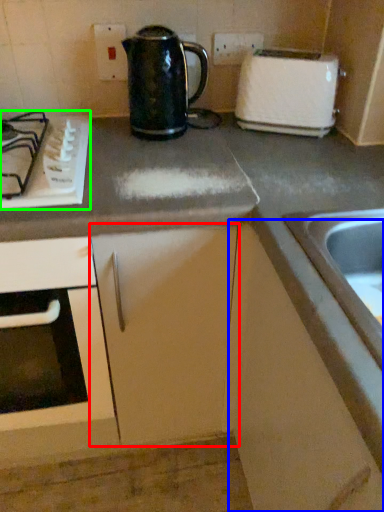
Question: Estimate the real-world distances between objects in this image. Which object is closer to cabinetry (highlighted by a red box), cabinetry (highlighted by a blue box) or gas stove (highlighted by a green box)?

Choices:
 (A) cabinetry
 (B) gas stove

Answer: (A)